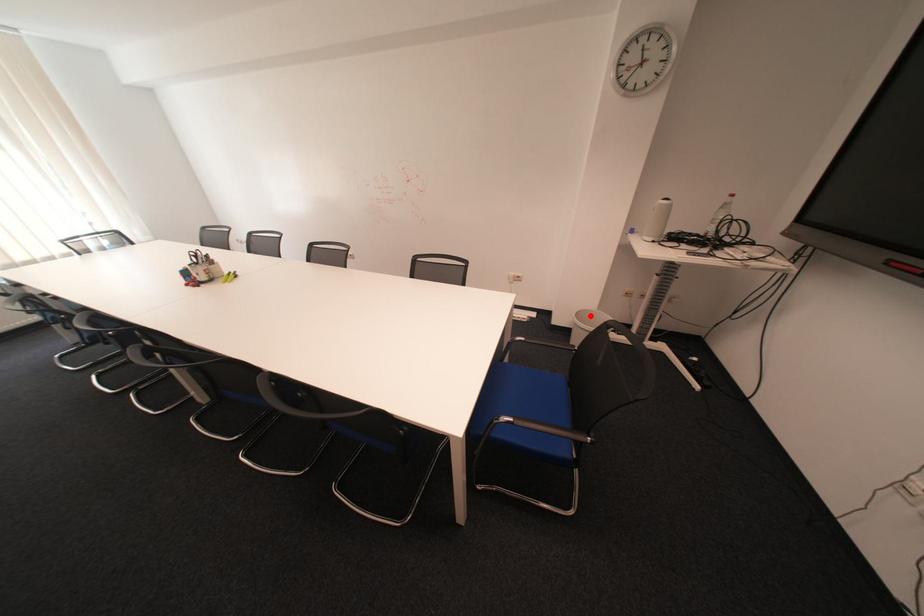
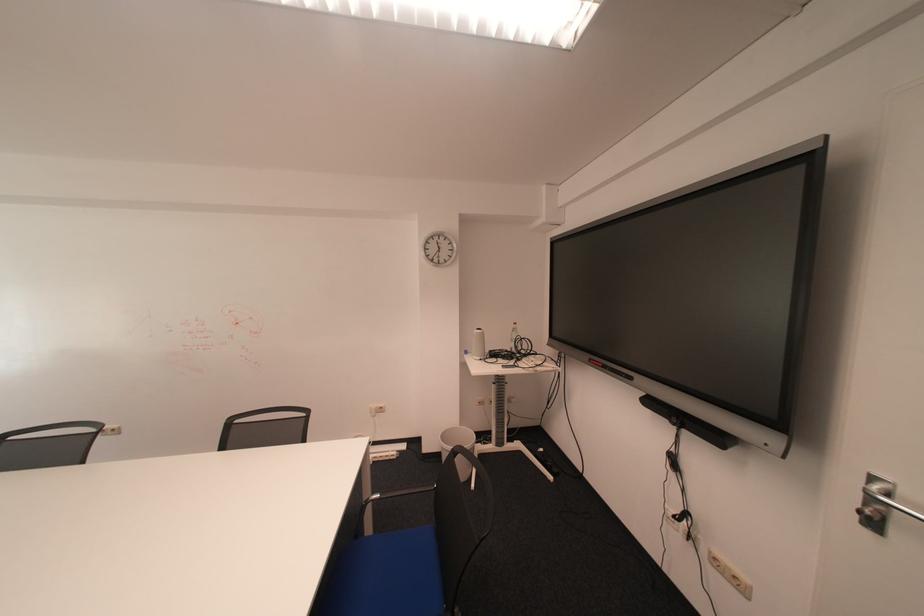
Question: I am providing you with two images of the same scene from different viewpoints. A red point is shown in image1. For the corresponding object point in image2, is it positioned nearer or farther from the camera?

Choices:
 (A) Nearer
 (B) Farther

Answer: (B)